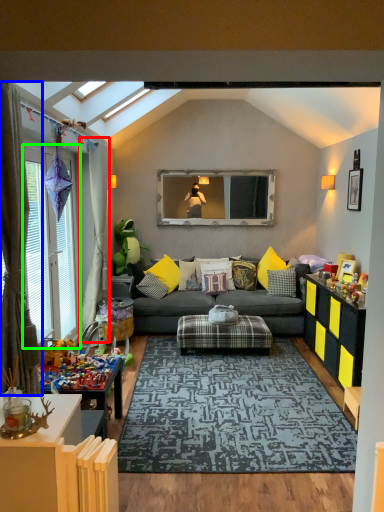
Question: Which is nearer to the curtain (highlighted by a red box)? curtain (highlighted by a blue box) or window (highlighted by a green box).

Choices:
 (A) curtain
 (B) window

Answer: (B)